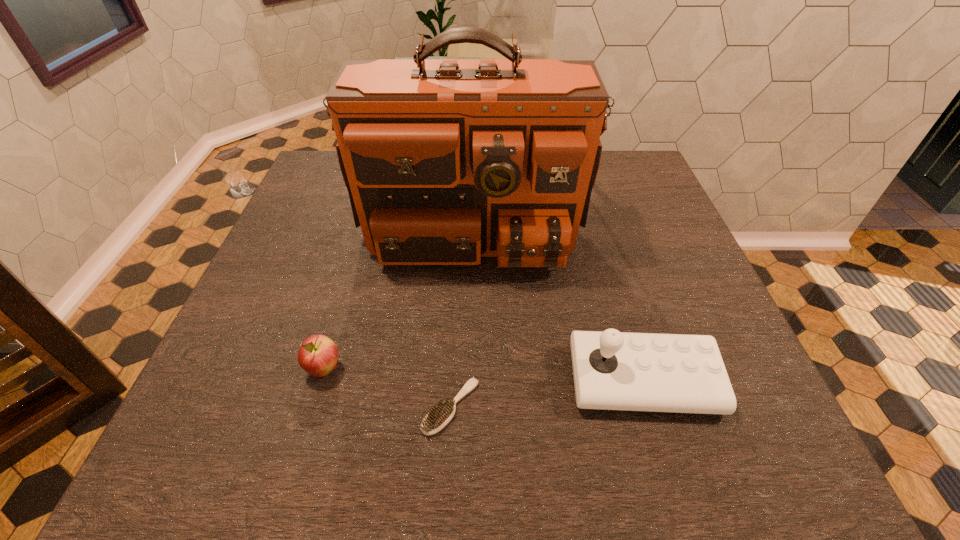
The width and height of the screenshot is (960, 540). I want to click on object that is at the near edge, so click(x=440, y=415).

Find the location of a particular element. This screenshot has width=960, height=540. object at the right edge is located at coordinates (612, 370).

Find the location of a particular element. The image size is (960, 540). vacant space at the near edge of the desktop is located at coordinates (420, 431).

In the image, there is a desktop. Where is `vacant space at the left edge`? vacant space at the left edge is located at coordinates (x=263, y=295).

Locate an element on the screen. This screenshot has height=540, width=960. free space at the right edge of the desktop is located at coordinates (633, 237).

I want to click on free spot between the third tallest object and the second tallest object, so click(x=484, y=375).

Identify the location of free space that is in between the apple and the joystick. (484, 375).

The width and height of the screenshot is (960, 540). In order to click on empty space between the farthest object and the scrubbing brush in this screenshot , I will do `click(461, 306)`.

Where is `empty space that is in between the shortest object and the apple`? The image size is (960, 540). empty space that is in between the shortest object and the apple is located at coordinates (388, 388).

You are a GUI agent. You are given a task and a screenshot of the screen. Output one action in this format:
    pyautogui.click(x=<x>, y=<y>)
    Task: Click on the vacant point located between the scrubbing brush and the second tallest object
    The width and height of the screenshot is (960, 540).
    Given the screenshot: What is the action you would take?
    pyautogui.click(x=547, y=394)